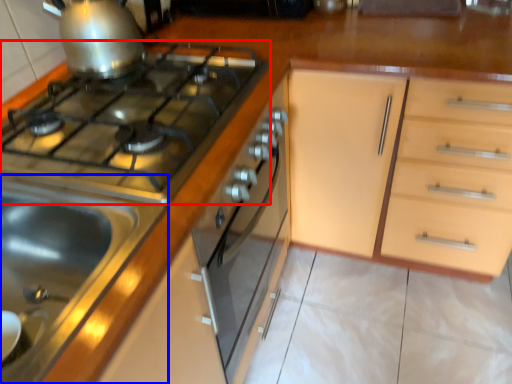
Question: Which object is closer to the camera taking this photo, gas stove (highlighted by a red box) or sink (highlighted by a blue box)?

Choices:
 (A) gas stove
 (B) sink

Answer: (B)